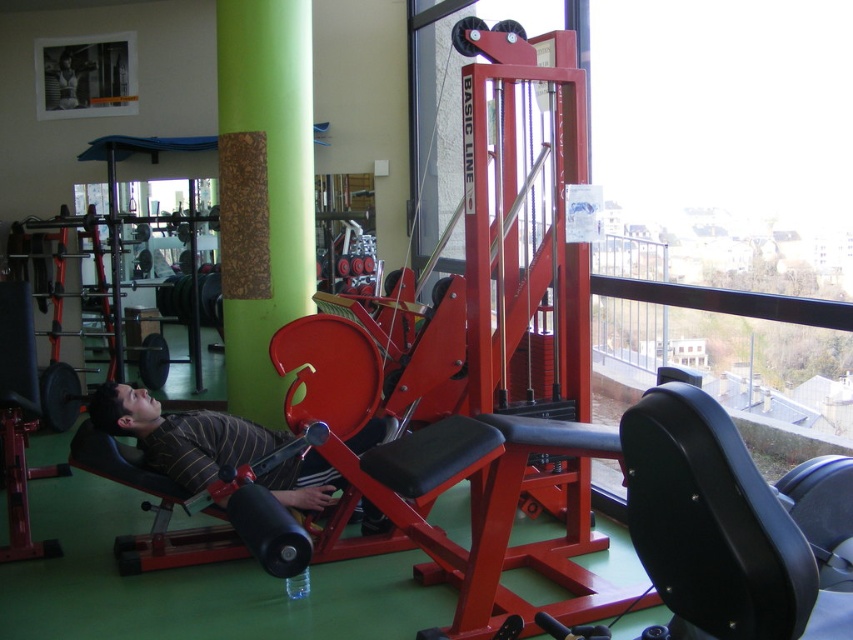
Is cork-textured board at center bigger than striped fabric shirt at center?

Correct, cork-textured board at center is larger in size than striped fabric shirt at center.

Looking at this image, who is taller, cork-textured board at center or striped fabric shirt at center?

cork-textured board at center

Does point (283, 186) come farther from viewer compared to point (141, 436)?

Yes.

You are a GUI agent. You are given a task and a screenshot of the screen. Output one action in this format:
    pyautogui.click(x=<x>, y=<y>)
    Task: Click on the cork-textured board at center
    Image resolution: width=853 pixels, height=640 pixels.
    Given the screenshot: What is the action you would take?
    pyautogui.click(x=263, y=189)